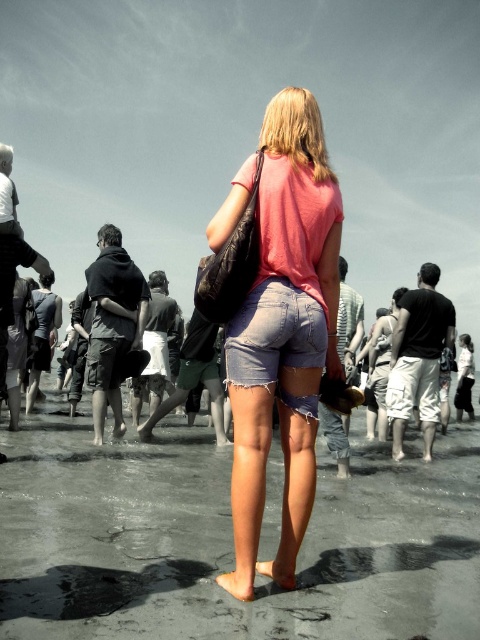
Does ripped denim shorts at center lie behind pink denim shorts at center?

Yes, it is behind pink denim shorts at center.

Between ripped denim shorts at center and pink denim shorts at center, which one appears on the right side from the viewer's perspective?

pink denim shorts at center is more to the right.

This screenshot has height=640, width=480. Identify the location of ripped denim shorts at center. (228, 541).